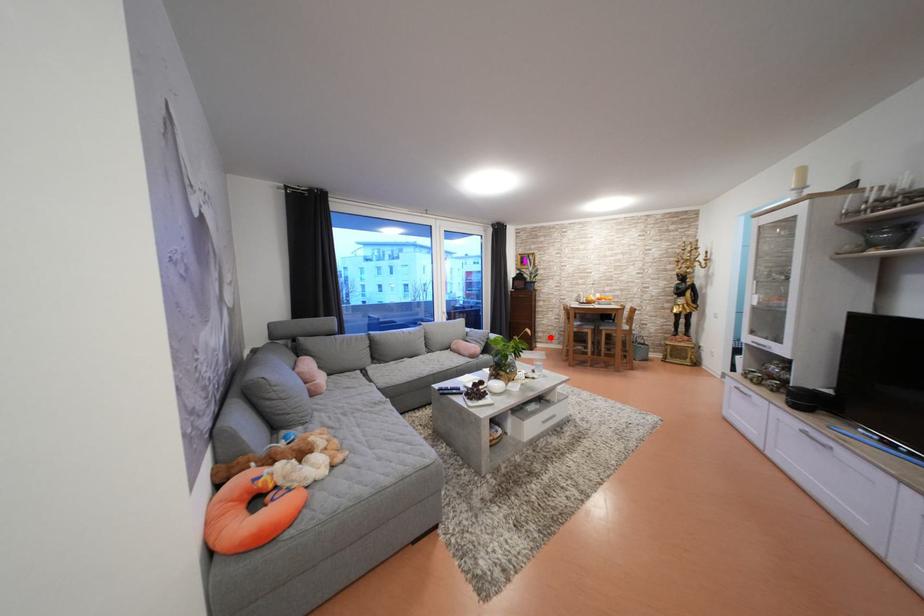
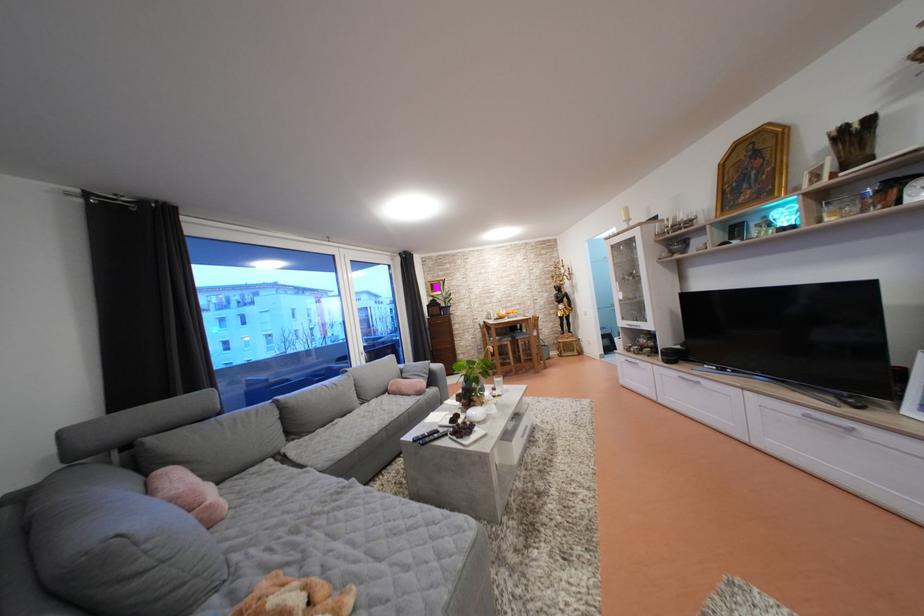
Question: I am providing you with two images of the same scene from different viewpoints. A red point is shown in image1. For the corresponding object point in image2, is it positioned nearer or farther from the camera?

Choices:
 (A) Nearer
 (B) Farther

Answer: (A)